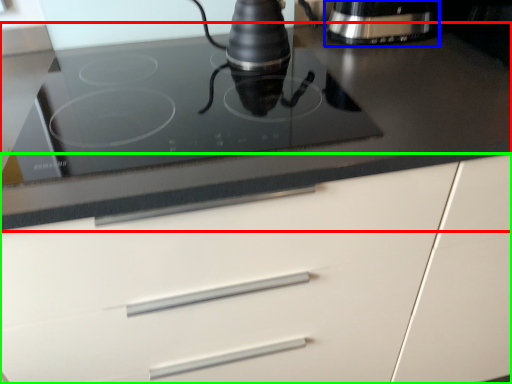
Question: Estimate the real-world distances between objects in this image. Which object is closer to countertop (highlighted by a red box), home appliance (highlighted by a blue box) or cabinetry (highlighted by a green box)?

Choices:
 (A) home appliance
 (B) cabinetry

Answer: (B)